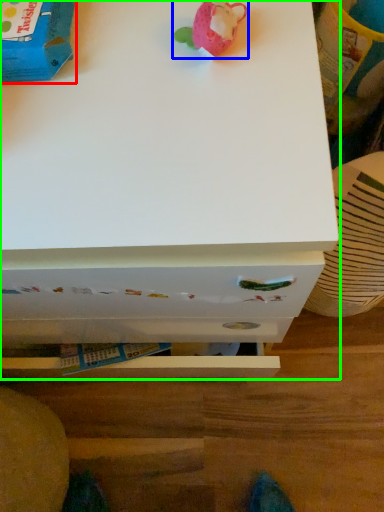
Question: Which is nearer to the toy (highlighted by a red box)? toy (highlighted by a blue box) or chest of drawers (highlighted by a green box).

Choices:
 (A) toy
 (B) chest of drawers

Answer: (A)